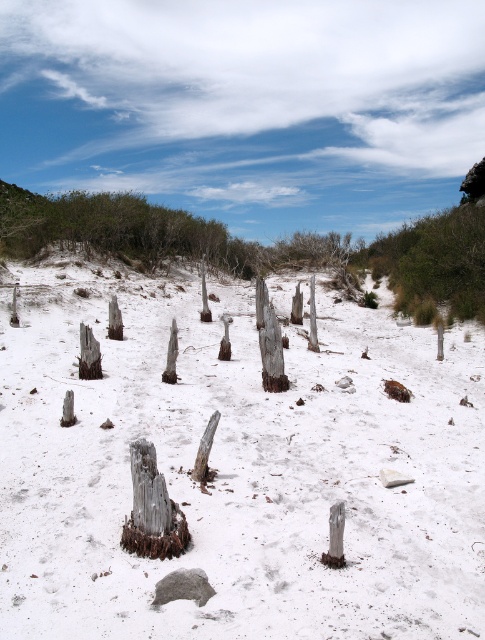
You are standing at the edge of the image and want to reach the white sandy beach at center. Which direction should you move in to get there?

The white sandy beach at center is located at coordinates approximately 0.733 on the x axis and 0.491 on the y axis. Since you are at the edge, you should move towards the center of the image to reach it.